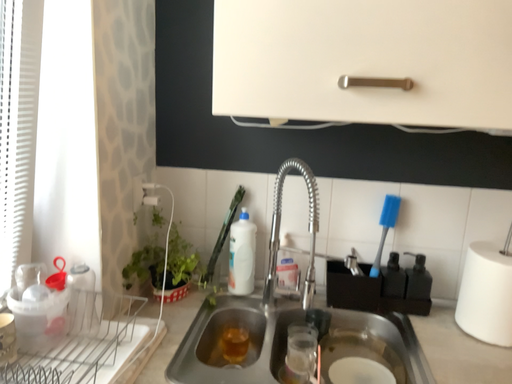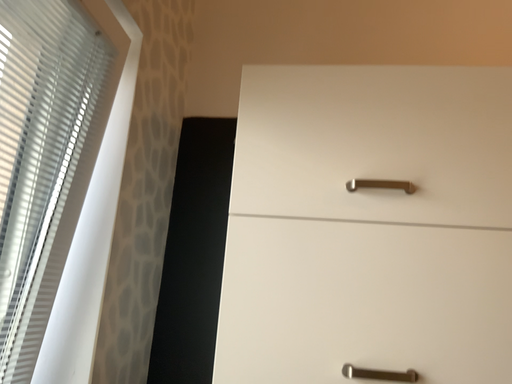
Question: How did the camera likely rotate when shooting the video?

Choices:
 (A) rotated downward
 (B) rotated upward

Answer: (B)